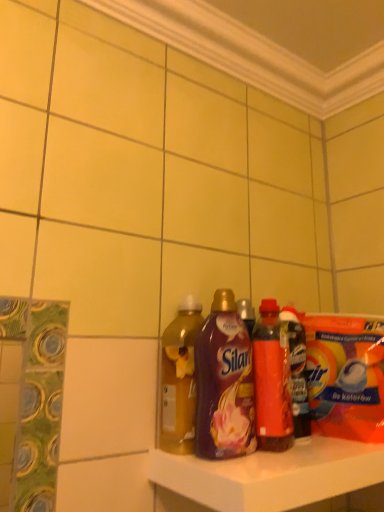
Locate an element on the screen. This screenshot has width=384, height=512. free location to the right of translucent yellow liquid at center, placed as the first bottle when sorted from left to right is located at coordinates point(297,454).